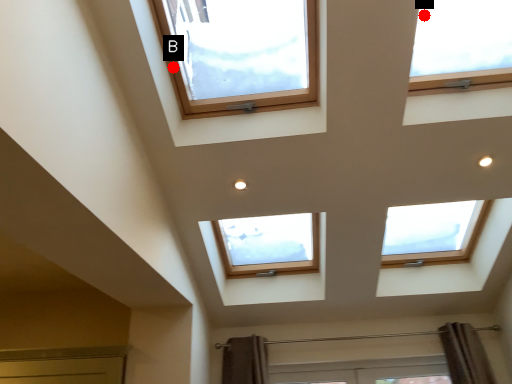
Question: Two points are circled on the image, labeled by A and B beside each circle. Which point is closer to the camera?

Choices:
 (A) A is closer
 (B) B is closer

Answer: (A)